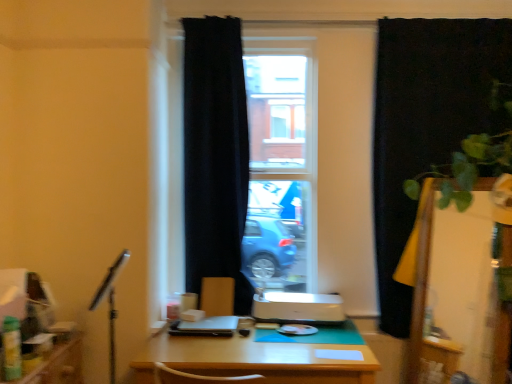
Where is `vacant region above wooden desk at center (from a real-world perspective)`? The height and width of the screenshot is (384, 512). vacant region above wooden desk at center (from a real-world perspective) is located at coordinates (289, 336).